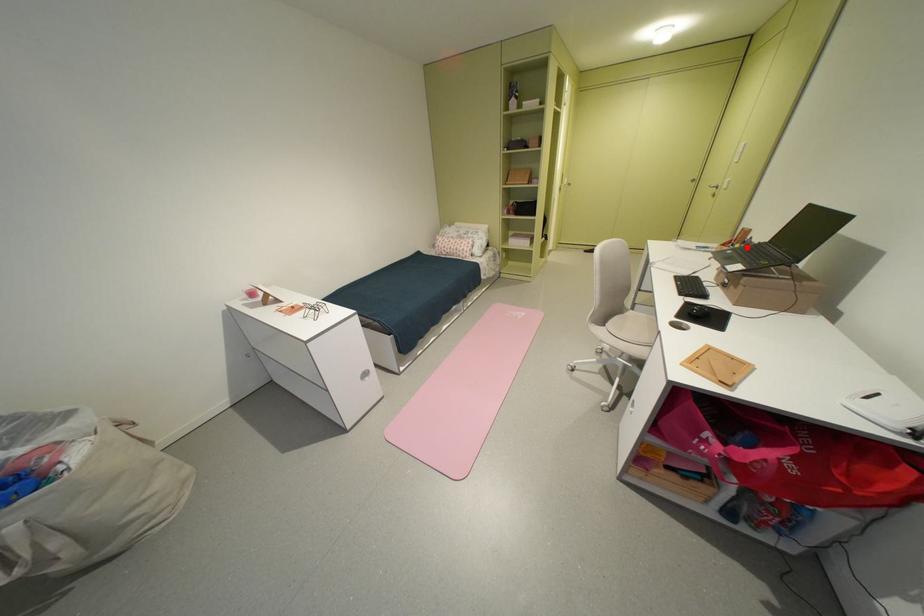
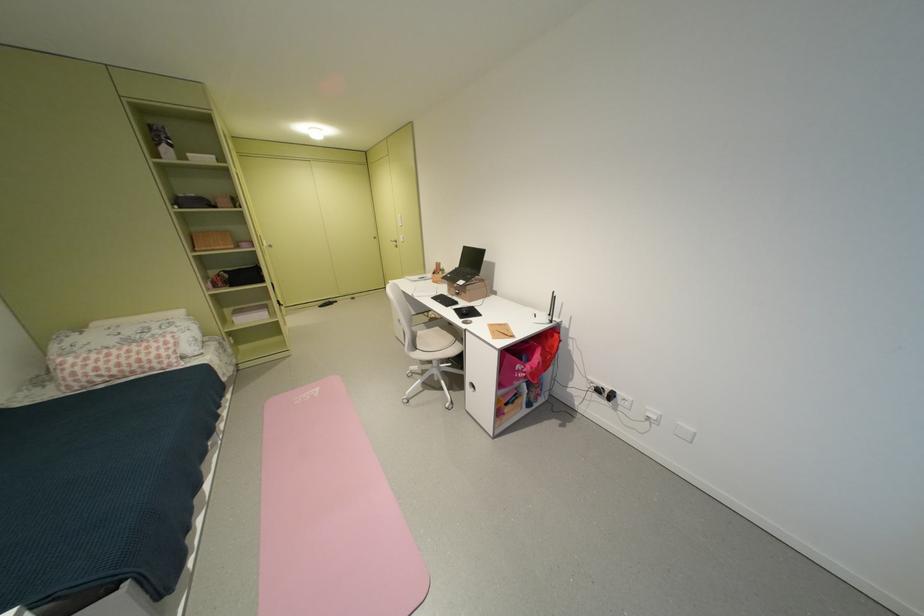
Find the pixel in the second image that matches the highlighted location in the first image.

(450, 274)